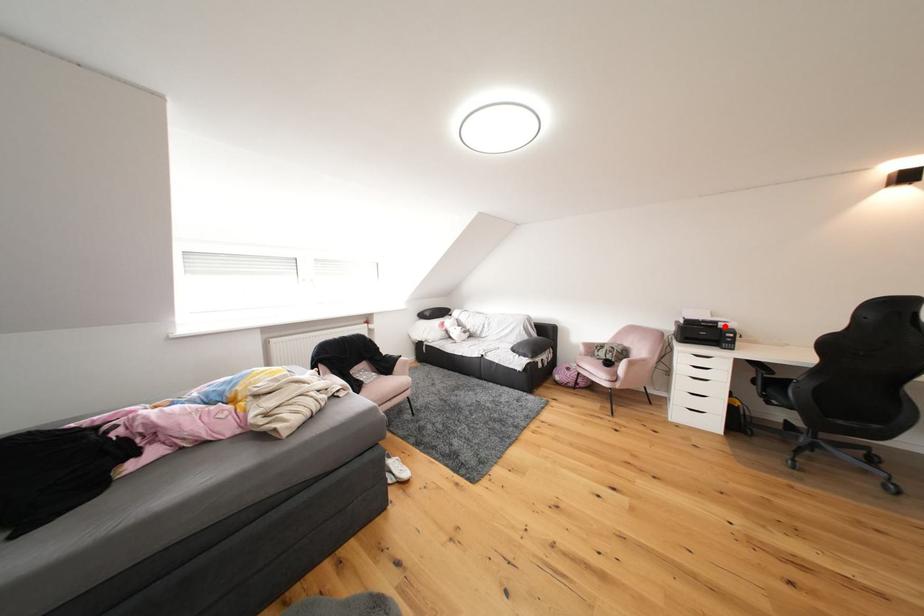
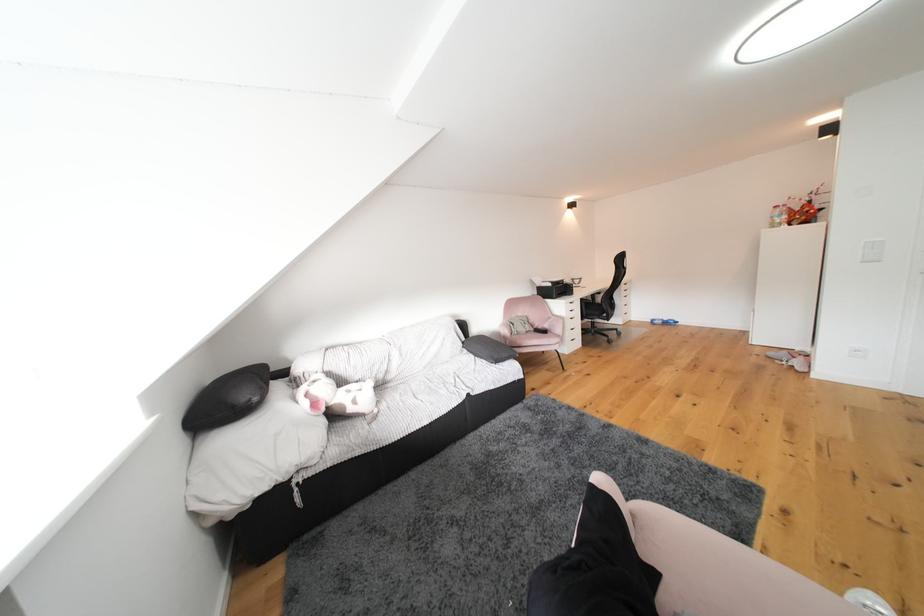
Find the pixel in the second image that matches the highlighted location in the first image.

(572, 285)